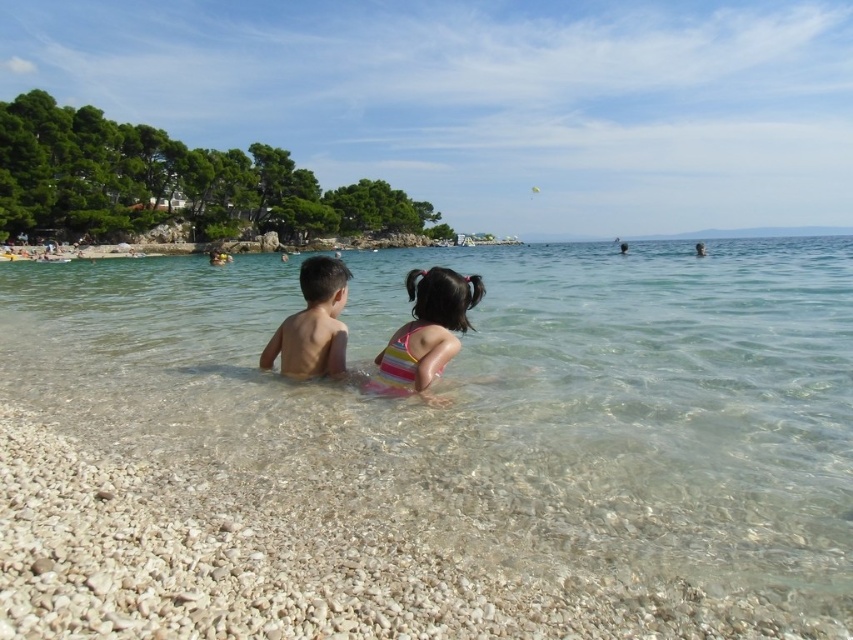
The width and height of the screenshot is (853, 640). Identify the location of clear water at center. (503, 413).

Between point (656, 436) and point (425, 273), which one is positioned in front?

Positioned in front is point (656, 436).

Locate an element on the screen. This screenshot has height=640, width=853. clear water at center is located at coordinates (503, 413).

Consider the image. Can you confirm if striped swimsuit at center is smaller than naked skin boy at center?

Correct, striped swimsuit at center occupies less space than naked skin boy at center.

Where is `striped swimsuit at center`? Image resolution: width=853 pixels, height=640 pixels. striped swimsuit at center is located at coordinates (426, 330).

Looking at this image, can you confirm if clear water at center is smaller than naked skin boy at center?

No.

Looking at this image, who is taller, clear water at center or naked skin boy at center?

Standing taller between the two is clear water at center.

You are a GUI agent. You are given a task and a screenshot of the screen. Output one action in this format:
    pyautogui.click(x=<x>, y=<y>)
    Task: Click on the clear water at center
    
    Given the screenshot: What is the action you would take?
    pyautogui.click(x=503, y=413)